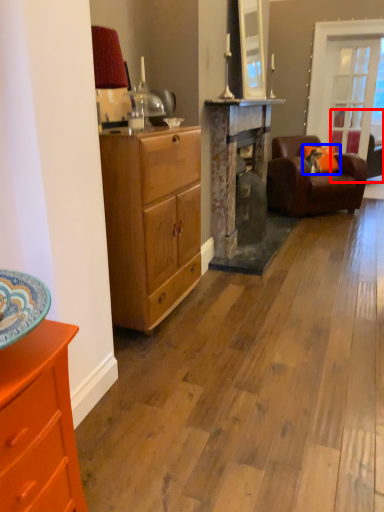
Question: Which object appears farthest to the camera in this image, studio couch (highlighted by a red box) or pillow (highlighted by a blue box)?

Choices:
 (A) studio couch
 (B) pillow

Answer: (A)